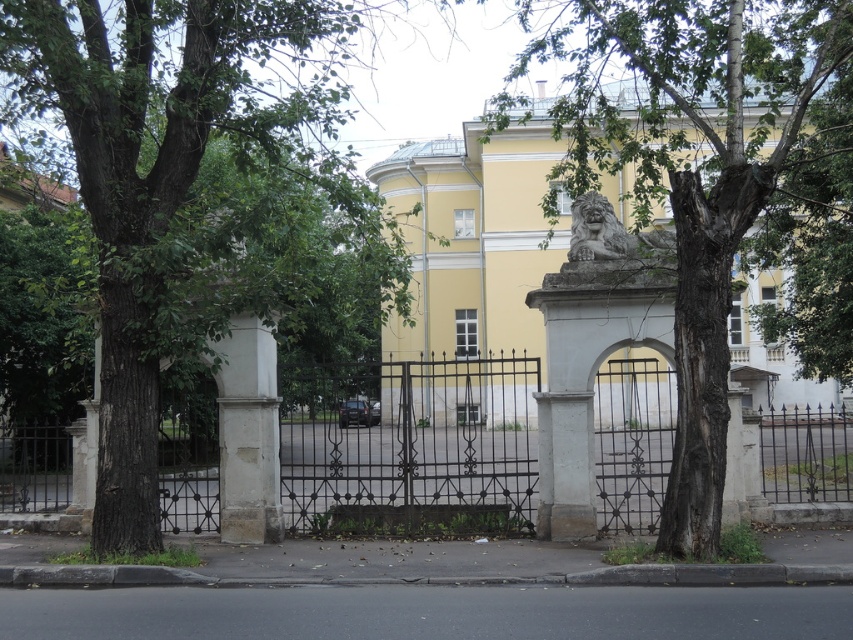
Question: Does green leafy tree at left appear over polished stone lion at center?

Choices:
 (A) yes
 (B) no

Answer: (A)

Question: Considering the relative positions of green leafy tree at left and polished stone lion at center in the image provided, where is green leafy tree at left located with respect to polished stone lion at center?

Choices:
 (A) below
 (B) above

Answer: (B)

Question: Which point is closer to the camera taking this photo?

Choices:
 (A) (815, 456)
 (B) (712, 515)
 (C) (598, 218)

Answer: (B)

Question: Which object is closer to the camera taking this photo?

Choices:
 (A) green leafy tree at left
 (B) black wrought iron gate at center
 (C) green leafy tree at center

Answer: (A)

Question: From the image, what is the correct spatial relationship of green leafy tree at left in relation to black wrought iron gate at center?

Choices:
 (A) right
 (B) left

Answer: (B)

Question: Considering the real-world distances, which object is closest to the polished stone lion at center?

Choices:
 (A) green leafy tree at left
 (B) black wrought iron gate at center
 (C) green leafy tree at center

Answer: (A)